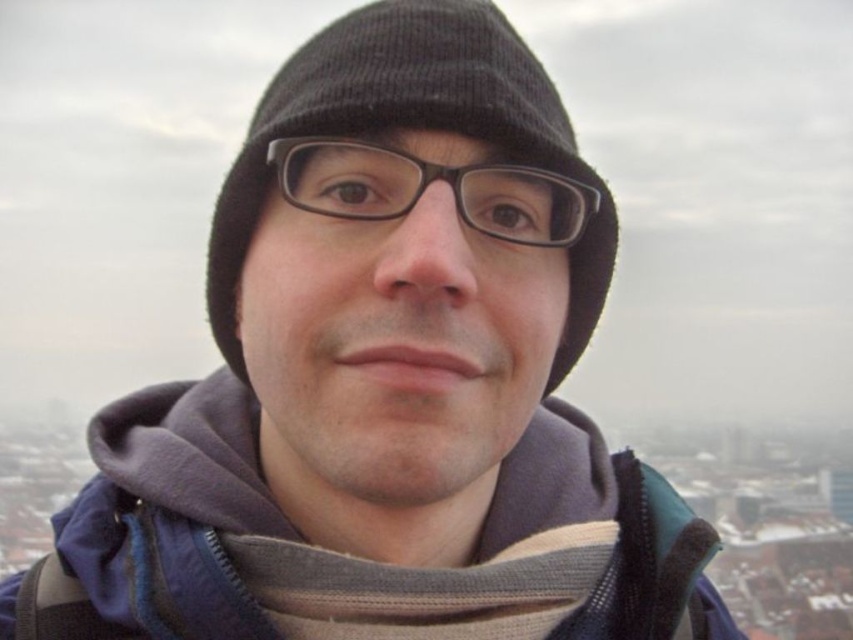
You are a photographer trying to capture the black knit hat at center and the navy blue fleece jacket at center in a single shot. Based on their positions, which object will appear larger in the photo?

The navy blue fleece jacket at center will appear larger in the photo because it is closer to the viewer than the black knit hat at center.

Looking at the person in the image, which object is positioned to the left of the other between the navy blue fleece jacket at center and the black knit hat at center?

The navy blue fleece jacket at center is positioned to the left of the black knit hat at center.